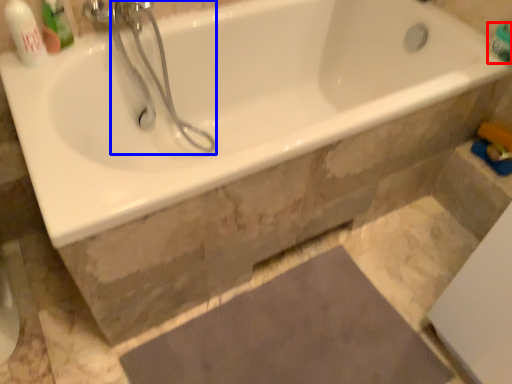
Question: Which of the following is the closest to the observer, toiletry (highlighted by a red box) or shower (highlighted by a blue box)?

Choices:
 (A) toiletry
 (B) shower

Answer: (B)